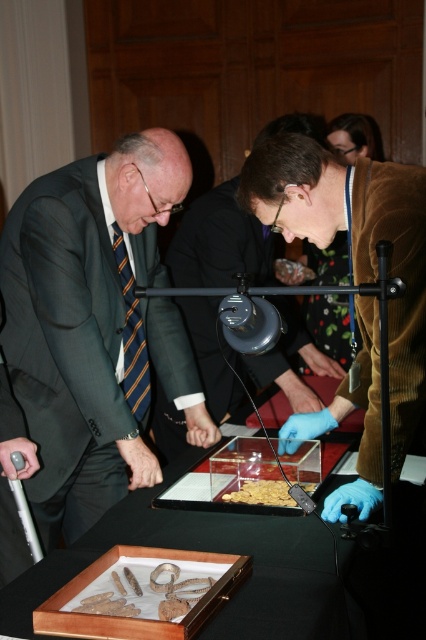
You are a museum curator arranging an exhibit. You have a transparent glass tray at center and a floral fabric dress at center. Which object should you place first if you want to ensure the larger item is positioned in the most prominent area of the display?

You should place the transparent glass tray at center first since it is larger than the floral fabric dress at center and needs to be positioned in the prominent area.

You are a museum curator arranging an exhibition. You have a floral fabric dress at center and a translucent plastic food at center on the same display table. Which object should you move to make more space for a new artifact that requires a larger area? Explain your choice based on their sizes.

The floral fabric dress at center is larger in size than the translucent plastic food at center. To make more space for the new artifact, you should move the floral fabric dress at center since it occupies more space.